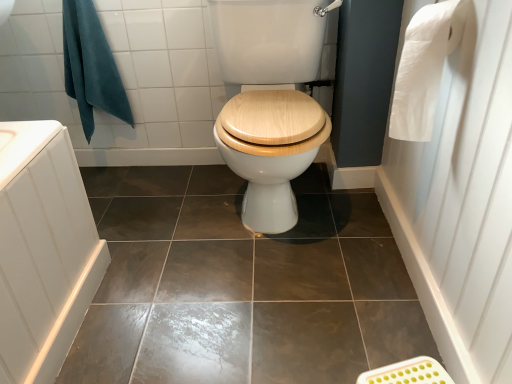
What is the approximate width of teal fabric towel at upper left?

The width of teal fabric towel at upper left is 6.16 inches.

At what (x,y) coordinates should I click in order to perform the action: click on brown glossy tile at center. Please return your answer as a coordinate pair (x, y). The height and width of the screenshot is (384, 512). Looking at the image, I should click on (241, 285).

Based on the photo, are white paper at upper right and teal fabric towel at upper left located far from each other?

Yes, white paper at upper right and teal fabric towel at upper left are located far from each other.

Is teal fabric towel at upper left completely or partially inside white paper at upper right?

No, teal fabric towel at upper left is not inside white paper at upper right.

Which point is more forward, (404, 77) or (104, 98)?

→ The point (404, 77) is closer.

Identify the location of ceramic tile that appears below the teal fabric towel at upper left (from the image's perspective). The width and height of the screenshot is (512, 384). (241, 285).

Is teal fabric towel at upper left positioned with its back to brown glossy tile at center?

That's not correct — teal fabric towel at upper left is not looking away from brown glossy tile at center.

What's the angular difference between teal fabric towel at upper left and brown glossy tile at center's facing directions?

They differ by 0.0562 degrees in their facing directions.

How many degrees apart are the facing directions of teal fabric towel at upper left and white paper towel at right?

They differ by 90 degrees in their facing directions.

Are teal fabric towel at upper left and white paper towel at right located far from each other?

Yes, teal fabric towel at upper left and white paper towel at right are located far from each other.

Which is correct: teal fabric towel at upper left is inside white paper towel at right, or outside of it?

teal fabric towel at upper left is not enclosed by white paper towel at right.

This screenshot has width=512, height=384. In order to click on bath towel above the white paper towel at right (from a real-world perspective) in this screenshot , I will do `click(91, 66)`.

Does point (396, 126) lie behind point (494, 237)?

That is True.

From the image's perspective, is white paper at upper right on white paper towel at right?

Yes.

Between white paper at upper right and white paper towel at right, which one has less height?

With less height is white paper at upper right.

Is white paper towel at right at the back of white paper at upper right?

Yes, white paper at upper right is facing away from white paper towel at right.

Can you confirm if white paper towel at right is taller than brown glossy tile at center?

Yes.

Is white paper towel at right touching brown glossy tile at center?

No, white paper towel at right is not in contact with brown glossy tile at center.

Can we say white paper towel at right lies outside brown glossy tile at center?

white paper towel at right lies outside brown glossy tile at center's area.

The image size is (512, 384). I want to click on side above the brown glossy tile at center (from a real-world perspective), so click(462, 202).

This screenshot has width=512, height=384. In the image, there is a white paper at upper right. Find the location of `side below it (from a real-world perspective)`. side below it (from a real-world perspective) is located at coordinates (462, 202).

Looking at this image, between white paper towel at right and white paper at upper right, which one has smaller size?

white paper at upper right is smaller.

Which is correct: white paper towel at right is inside white paper at upper right, or outside of it?

white paper towel at right is outside white paper at upper right.

Does white paper towel at right have a lesser height compared to white paper at upper right?

In fact, white paper towel at right may be taller than white paper at upper right.

Considering the positions of objects white paper at upper right and brown glossy tile at center in the image provided, who is behind, white paper at upper right or brown glossy tile at center?

brown glossy tile at center.

Does point (402, 121) appear closer or farther from the camera than point (113, 301)?

Point (402, 121) appears to be closer to the viewer than point (113, 301).

Identify the location of bath towel on the left of white paper at upper right. (91, 66).

In order to click on ceramic tile below the teal fabric towel at upper left (from a real-world perspective) in this screenshot , I will do `click(241, 285)`.

Looking at the image, which one is located further to teal fabric towel at upper left, white paper at upper right or brown glossy tile at center?

The object further to teal fabric towel at upper left is white paper at upper right.

When comparing their distances from brown glossy tile at center, does white paper towel at right or teal fabric towel at upper left seem closer?

The object closer to brown glossy tile at center is white paper towel at right.

Which object lies nearer to the anchor point brown glossy tile at center, white paper at upper right or white paper towel at right?

Result: Among the two, white paper towel at right is located nearer to brown glossy tile at center.

Looking at the image, which one is located further to brown glossy tile at center, white paper towel at right or white paper at upper right?

The object further to brown glossy tile at center is white paper at upper right.

Looking at the image, which one is located closer to teal fabric towel at upper left, white paper at upper right or white paper towel at right?

white paper at upper right lies closer to teal fabric towel at upper left than the other object.

Based on their spatial positions, is brown glossy tile at center or white paper at upper right closer to white paper towel at right?

The object closer to white paper towel at right is white paper at upper right.

Based on their spatial positions, is brown glossy tile at center or teal fabric towel at upper left closer to white paper at upper right?

brown glossy tile at center is positioned closer to the anchor white paper at upper right.

In the scene shown: Based on their spatial positions, is teal fabric towel at upper left or white paper at upper right further from white paper towel at right?

A: teal fabric towel at upper left is positioned further to the anchor white paper towel at right.

Find the location of a particular element. toilet paper between brown glossy tile at center and white paper towel at right from left to right is located at coordinates (424, 68).

Find the location of a particular element. toilet paper between teal fabric towel at upper left and white paper towel at right from left to right is located at coordinates (424, 68).

At what (x,y) coordinates should I click in order to perform the action: click on ceramic tile between teal fabric towel at upper left and white paper towel at right from left to right. Please return your answer as a coordinate pair (x, y). This screenshot has width=512, height=384. Looking at the image, I should click on (241, 285).

The height and width of the screenshot is (384, 512). I want to click on ceramic tile between teal fabric towel at upper left and white paper at upper right from left to right, so click(241, 285).